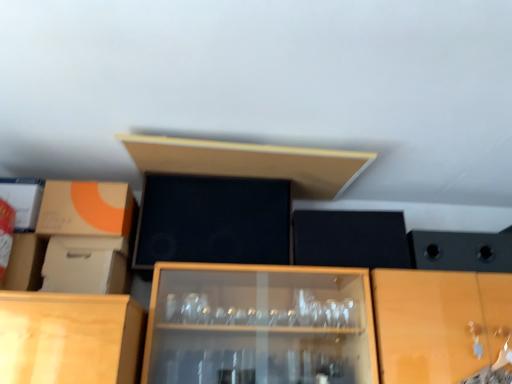
Question: Is matte cardboard box at left, the second cardboard box positioned from the bottom, oriented away from black matte speaker at center?

Choices:
 (A) no
 (B) yes

Answer: (A)

Question: From the image's perspective, is matte cardboard box at left, the second cardboard box positioned from the bottom, above black matte speaker at center?

Choices:
 (A) no
 (B) yes

Answer: (B)

Question: Does matte cardboard box at left, the second cardboard box positioned from the bottom, have a greater height compared to black matte speaker at center?

Choices:
 (A) no
 (B) yes

Answer: (A)

Question: Is matte cardboard box at left, which is the first cardboard box from top to bottom, not inside black matte speaker at center?

Choices:
 (A) no
 (B) yes

Answer: (B)

Question: Considering the relative sizes of matte cardboard box at left, which is the first cardboard box from top to bottom, and black matte speaker at center in the image provided, is matte cardboard box at left, which is the first cardboard box from top to bottom, bigger than black matte speaker at center?

Choices:
 (A) yes
 (B) no

Answer: (A)

Question: In terms of height, does white cardboard box at left, arranged as the second cardboard box when viewed from the top, look taller or shorter compared to matte wood shelf at upper center?

Choices:
 (A) short
 (B) tall

Answer: (B)

Question: From the image's perspective, is white cardboard box at left, which is counted as the 1th cardboard box, starting from the bottom, positioned above or below matte wood shelf at upper center?

Choices:
 (A) above
 (B) below

Answer: (B)

Question: Is white cardboard box at left, arranged as the second cardboard box when viewed from the top, inside or outside of matte wood shelf at upper center?

Choices:
 (A) inside
 (B) outside

Answer: (B)

Question: Is white cardboard box at left, which is counted as the 1th cardboard box, starting from the bottom, bigger or smaller than matte wood shelf at upper center?

Choices:
 (A) big
 (B) small

Answer: (B)

Question: Does point (276, 228) appear closer or farther from the camera than point (97, 246)?

Choices:
 (A) closer
 (B) farther

Answer: (B)

Question: Would you say black matte speaker at center is to the left or to the right of white cardboard box at left, which is counted as the 1th cardboard box, starting from the bottom, in the picture?

Choices:
 (A) left
 (B) right

Answer: (B)

Question: In terms of height, does black matte speaker at center look taller or shorter compared to white cardboard box at left, which is counted as the 1th cardboard box, starting from the bottom?

Choices:
 (A) tall
 (B) short

Answer: (A)

Question: Is black matte speaker at center situated inside white cardboard box at left, arranged as the second cardboard box when viewed from the top, or outside?

Choices:
 (A) inside
 (B) outside

Answer: (B)

Question: Is matte cardboard box at left, the second cardboard box positioned from the bottom, to the left or to the right of black matte speaker at center in the image?

Choices:
 (A) right
 (B) left

Answer: (B)

Question: In terms of height, does matte cardboard box at left, which is the first cardboard box from top to bottom, look taller or shorter compared to black matte speaker at center?

Choices:
 (A) tall
 (B) short

Answer: (B)